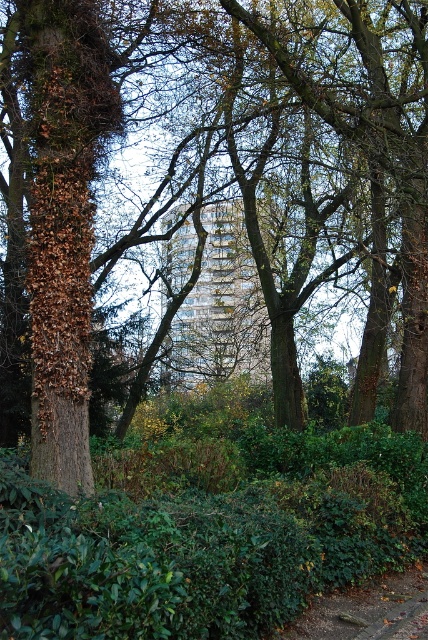
Question: Which point is farther from the camera taking this photo?

Choices:
 (A) (181, 493)
 (B) (374, 637)

Answer: (A)

Question: Which object appears farthest from the camera in this image?

Choices:
 (A) green leafy hedge at center
 (B) glassy reflective building at center
 (C) brown gravel path at lower center

Answer: (B)

Question: Based on their relative distances, which object is nearer to the glassy reflective building at center?

Choices:
 (A) green leafy hedge at center
 (B) brown gravel path at lower center

Answer: (B)

Question: Is glassy reflective building at center to the left of brown gravel path at lower center from the viewer's perspective?

Choices:
 (A) yes
 (B) no

Answer: (A)

Question: Is green leafy hedge at center positioned in front of brown gravel path at lower center?

Choices:
 (A) no
 (B) yes

Answer: (B)

Question: Can you confirm if green leafy hedge at center is thinner than glassy reflective building at center?

Choices:
 (A) no
 (B) yes

Answer: (B)